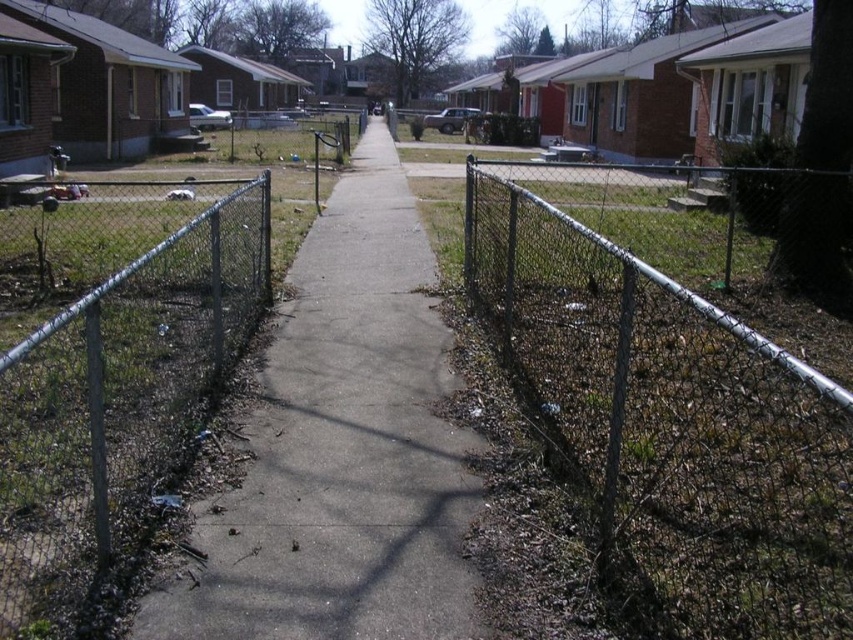
Question: Which point is farther to the camera?

Choices:
 (A) (280, 307)
 (B) (103, 368)
 (C) (519, 250)

Answer: (A)

Question: Is metal chain-link fence at center below metal chain-link fence at left?

Choices:
 (A) no
 (B) yes

Answer: (A)

Question: In this image, where is metal chain-link fence at center located relative to metal chain-link fence at left?

Choices:
 (A) above
 (B) below

Answer: (A)

Question: From the image, what is the correct spatial relationship of metal chain-link fence at center in relation to gray concrete sidewalk at center?

Choices:
 (A) left
 (B) right

Answer: (B)

Question: Which point is closer to the camera?

Choices:
 (A) metal chain-link fence at center
 (B) metal chain-link fence at left

Answer: (B)

Question: Which point is closer to the camera?

Choices:
 (A) (86, 486)
 (B) (787, 547)

Answer: (B)